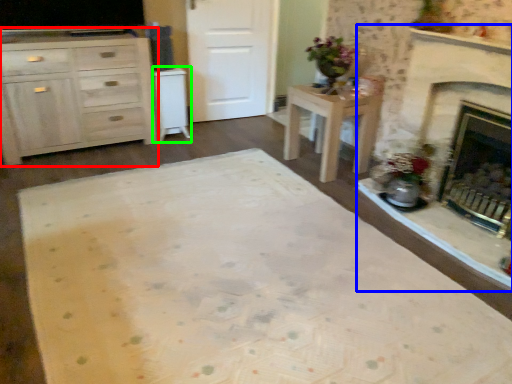
Question: Which object is positioned farthest from cabinetry (highlighted by a red box)? Select from fireplace (highlighted by a blue box) and cabinetry (highlighted by a green box).

Choices:
 (A) fireplace
 (B) cabinetry

Answer: (A)